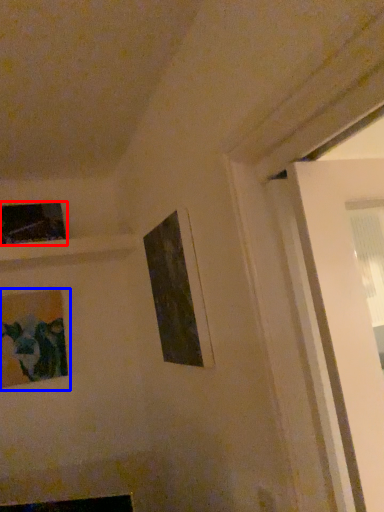
Question: Which of the following is the closest to the observer, picture frame (highlighted by a red box) or picture frame (highlighted by a blue box)?

Choices:
 (A) picture frame
 (B) picture frame

Answer: (B)